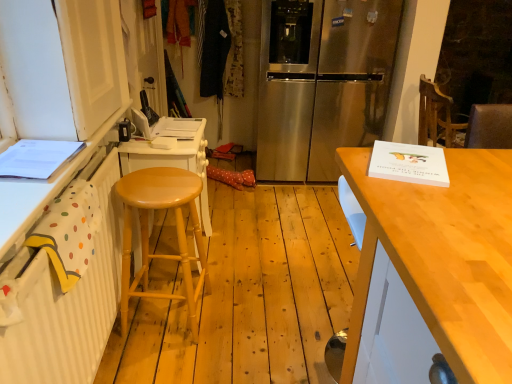
Identify the location of vacant space in between light wood stool at left and light wood table at right. (253, 337).